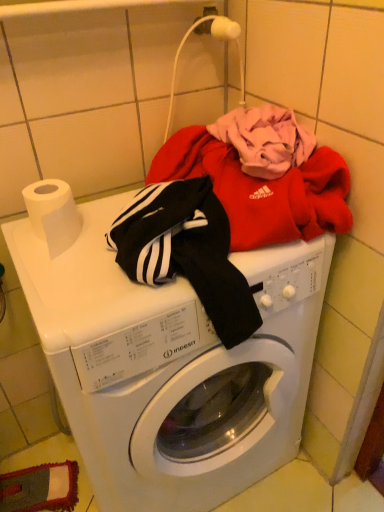
Question: Looking at their shapes, would you say white glossy washing machine at center is wider or thinner than white matte toilet paper at left?

Choices:
 (A) thin
 (B) wide

Answer: (B)

Question: Is white glossy washing machine at center spatially inside white matte toilet paper at left, or outside of it?

Choices:
 (A) outside
 (B) inside

Answer: (A)

Question: Looking at the image, does white glossy washing machine at center seem bigger or smaller compared to white matte toilet paper at left?

Choices:
 (A) big
 (B) small

Answer: (A)

Question: From their relative heights in the image, would you say white matte toilet paper at left is taller or shorter than white glossy washing machine at center?

Choices:
 (A) short
 (B) tall

Answer: (A)

Question: Is white matte toilet paper at left bigger or smaller than white glossy washing machine at center?

Choices:
 (A) big
 (B) small

Answer: (B)

Question: From a real-world perspective, is white matte toilet paper at left positioned above or below white glossy washing machine at center?

Choices:
 (A) below
 (B) above

Answer: (B)

Question: Looking at their shapes, would you say white matte toilet paper at left is wider or thinner than white glossy washing machine at center?

Choices:
 (A) thin
 (B) wide

Answer: (A)